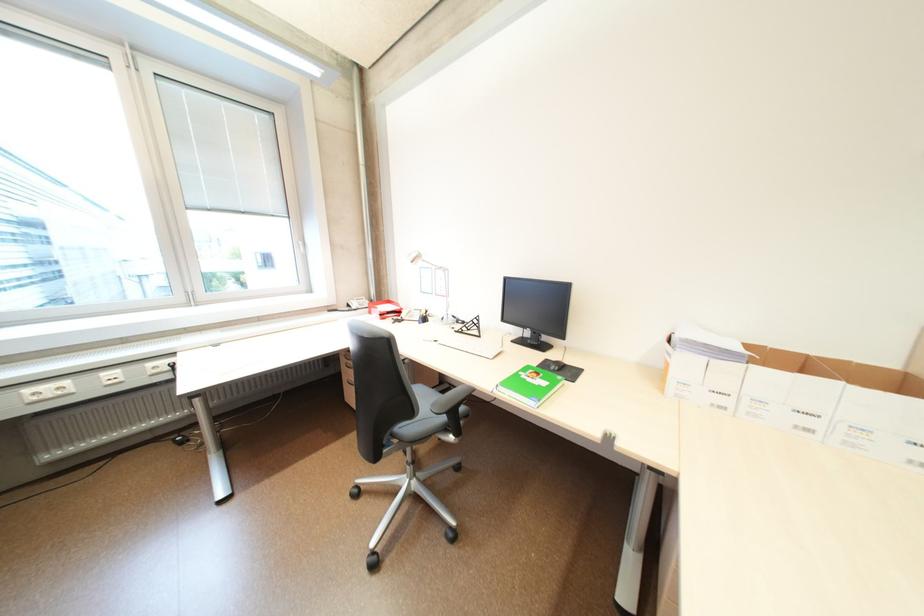
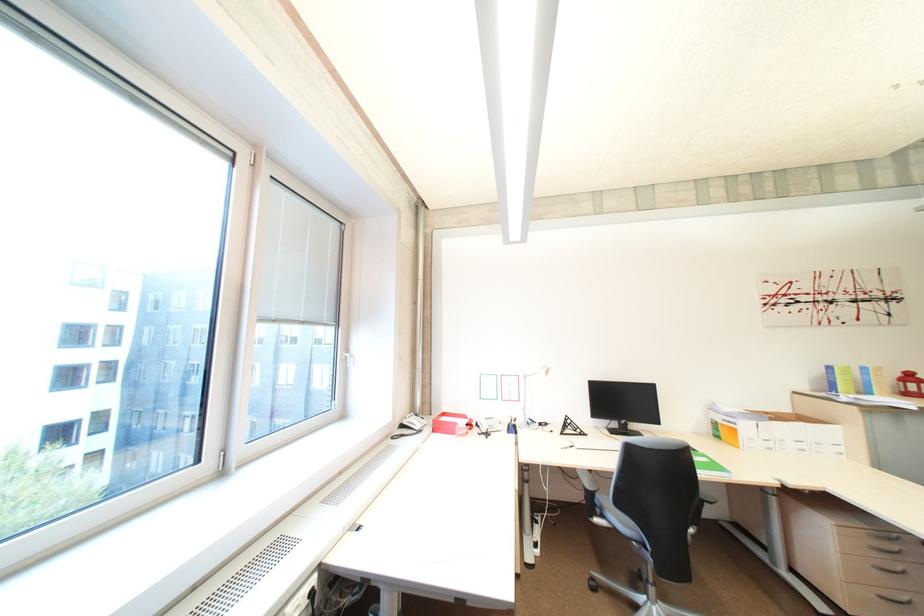
Where in the second image is the point corresponding to point 676,365 from the first image?

(745, 431)